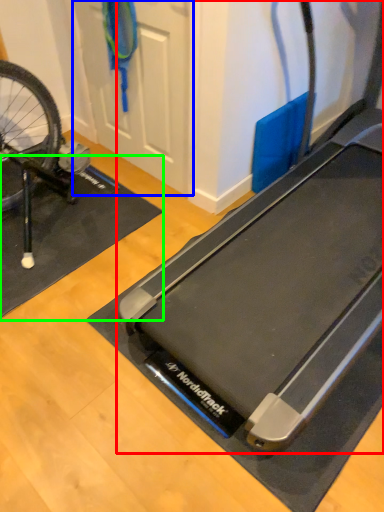
Question: Considering the real-world distances, which object is closest to treadmill (highlighted by a red box)? door (highlighted by a blue box) or yoga mat (highlighted by a green box).

Choices:
 (A) door
 (B) yoga mat

Answer: (B)